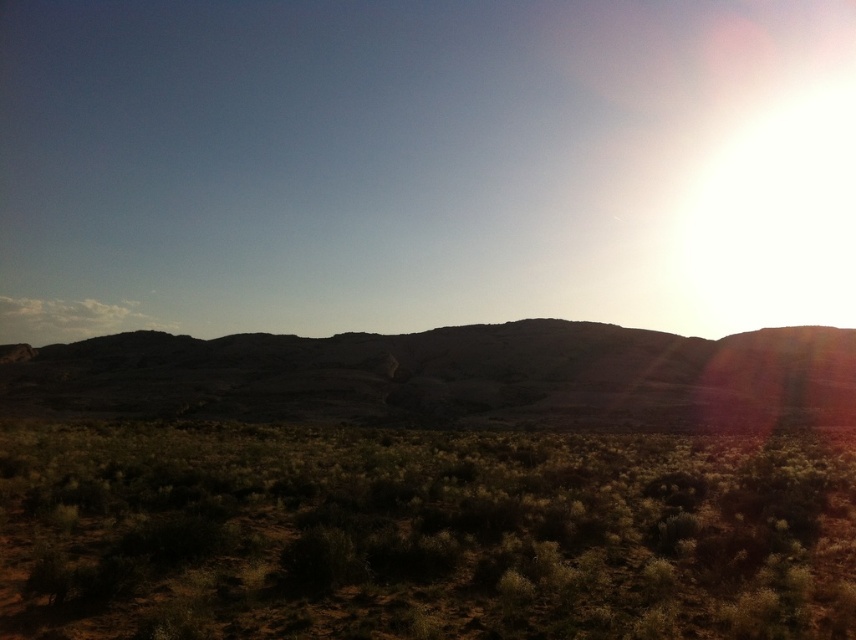
You are a hiker trying to navigate through the desert. You see the green shrubbery at lower center and the dull brown rock at center. Which object is shorter?

The green shrubbery at lower center is shorter than the dull brown rock at center.

You are a hiker navigating through the desert and see the green shrubbery at lower center and the dull brown rock at center. Which object would you encounter first as you move forward?

The green shrubbery at lower center is closer to the viewer than the dull brown rock at center, so you would encounter the green shrubbery at lower center first.